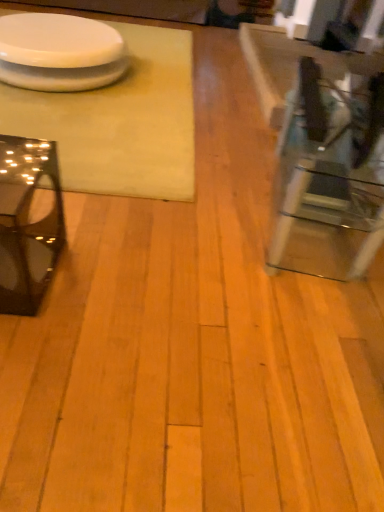
At what (x,y) coordinates should I click in order to perform the action: click on vacant area on the back side of glossy black glass table at left, the second table from the left. Please return your answer as a coordinate pair (x, y). Looking at the image, I should click on (83, 215).